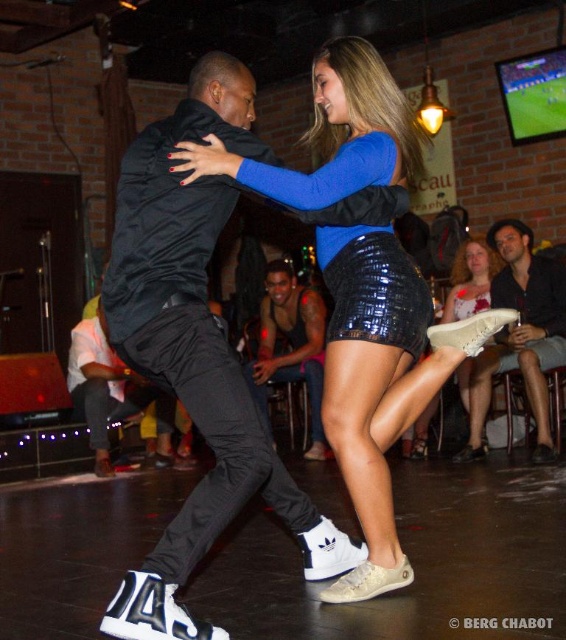
You are a photographer at the dance scene. You need to capture a closeup of the black matte pants at center and white matte shoe at lower center. Which object will appear larger in the photo?

The black matte pants at center will appear larger in the photo because it is bigger than the white matte shoe at lower center.